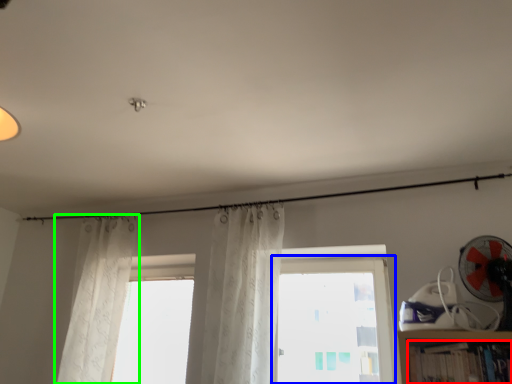
Question: Based on their relative distances, which object is nearer to book (highlighted by a red box)? Choose from window (highlighted by a blue box) and curtain (highlighted by a green box).

Choices:
 (A) window
 (B) curtain

Answer: (A)